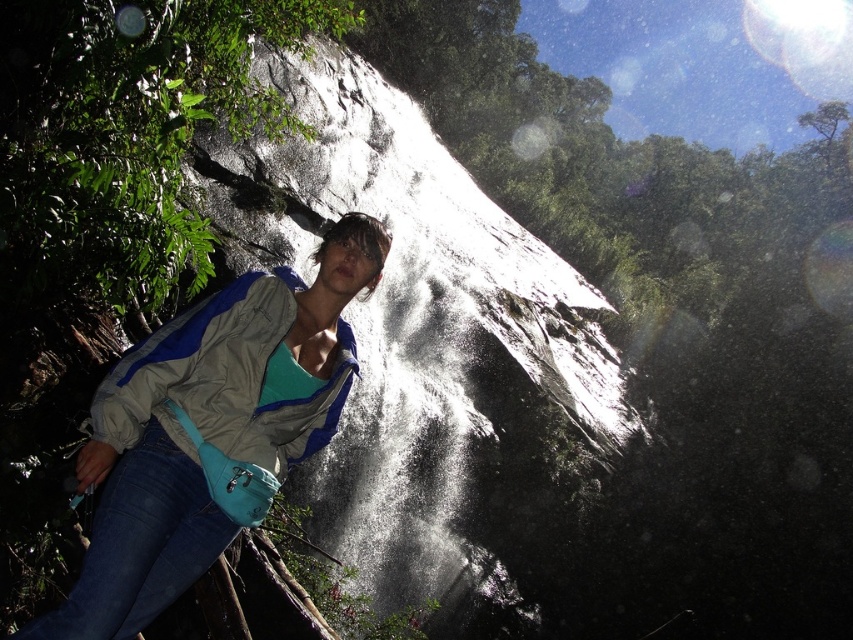
Question: Does matte blue jacket at center have a greater width compared to denim at left?

Choices:
 (A) yes
 (B) no

Answer: (A)

Question: Which object appears closest to the camera in this image?

Choices:
 (A) matte blue jacket at center
 (B) gray/blue fabric jacket at center

Answer: (A)

Question: Which of the following is the closest to the observer?

Choices:
 (A) denim at left
 (B) matte blue jacket at center
 (C) gray/blue fabric jacket at center

Answer: (A)

Question: Is matte blue jacket at center thinner than denim at left?

Choices:
 (A) no
 (B) yes

Answer: (A)

Question: Can you confirm if gray/blue fabric jacket at center is positioned above denim at left?

Choices:
 (A) no
 (B) yes

Answer: (B)

Question: Estimate the real-world distances between objects in this image. Which object is farther from the matte blue jacket at center?

Choices:
 (A) gray/blue fabric jacket at center
 (B) denim at left

Answer: (B)